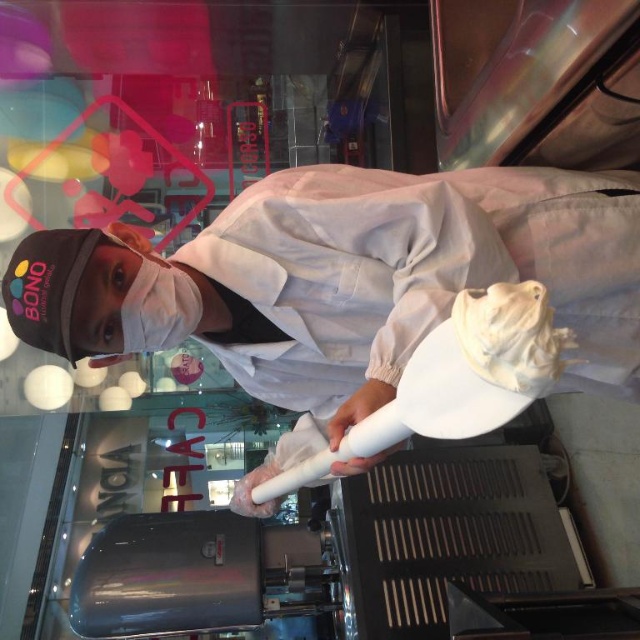
Question: Does white matte baseball cap at upper center have a lesser width compared to white fluffy cream at center?

Choices:
 (A) yes
 (B) no

Answer: (B)

Question: Which point is farther from the camera taking this photo?

Choices:
 (A) (604, 387)
 (B) (522, 301)

Answer: (A)

Question: Where is white matte baseball cap at upper center located in relation to white fluffy cream at center in the image?

Choices:
 (A) above
 (B) below

Answer: (B)

Question: Does white matte baseball cap at upper center appear under white fluffy cream at center?

Choices:
 (A) yes
 (B) no

Answer: (A)